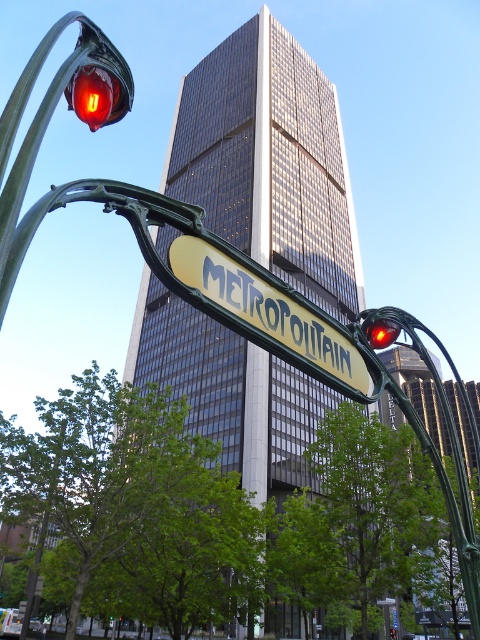
Is yellow-green metal sign at center smaller than glossy plastic traffic light at center?

No, yellow-green metal sign at center is not smaller than glossy plastic traffic light at center.

What do you see at coordinates (269, 316) in the screenshot? I see `yellow-green metal sign at center` at bounding box center [269, 316].

Image resolution: width=480 pixels, height=640 pixels. Identify the location of yellow-green metal sign at center. (269, 316).

Who is higher up, yellow-green metal sign at center or matte red traffic light at upper left?

matte red traffic light at upper left is above.

This screenshot has height=640, width=480. What do you see at coordinates (269, 316) in the screenshot? I see `yellow-green metal sign at center` at bounding box center [269, 316].

The height and width of the screenshot is (640, 480). I want to click on yellow-green metal sign at center, so click(x=269, y=316).

Which is in front, point (109, 104) or point (387, 321)?

Positioned in front is point (109, 104).

Is matte red traffic light at upper left closer to the viewer compared to glossy plastic traffic light at center?

That is True.

Between point (86, 90) and point (379, 326), which one is positioned behind?

Positioned behind is point (379, 326).

The height and width of the screenshot is (640, 480). Identify the location of matte red traffic light at upper left. (96, 97).